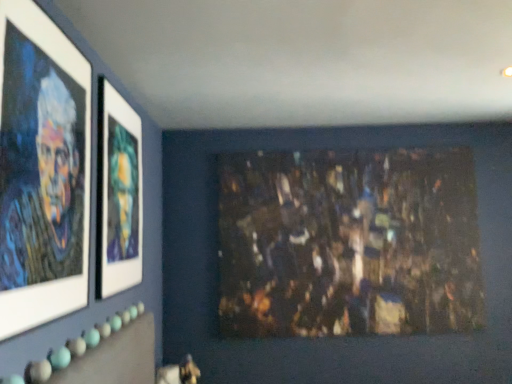
Question: From the image's perspective, is dark textured painting at center on top of matte glass picture frame at upper left, the second picture frame viewed from the front?

Choices:
 (A) no
 (B) yes

Answer: (A)

Question: From the image's perspective, is dark textured painting at center located beneath matte glass picture frame at upper left, the second picture frame viewed from the front?

Choices:
 (A) no
 (B) yes

Answer: (B)

Question: Could you tell me if dark textured painting at center is turned towards matte glass picture frame at upper left, the second picture frame viewed from the front?

Choices:
 (A) no
 (B) yes

Answer: (B)

Question: Considering the relative sizes of dark textured painting at center and matte glass picture frame at upper left, the first picture frame viewed from the back, in the image provided, is dark textured painting at center shorter than matte glass picture frame at upper left, the first picture frame viewed from the back,?

Choices:
 (A) yes
 (B) no

Answer: (B)

Question: Can you confirm if dark textured painting at center is smaller than matte glass picture frame at upper left, the second picture frame viewed from the front?

Choices:
 (A) no
 (B) yes

Answer: (A)

Question: Looking at their shapes, would you say matte black portrait at left, arranged as the 1th picture frame when viewed from the front, is wider or thinner than dark textured painting at center?

Choices:
 (A) wide
 (B) thin

Answer: (B)

Question: From the image's perspective, is matte black portrait at left, arranged as the 1th picture frame when viewed from the front, located above or below dark textured painting at center?

Choices:
 (A) below
 (B) above

Answer: (B)

Question: Would you say matte black portrait at left, arranged as the 1th picture frame when viewed from the front, is to the left or to the right of dark textured painting at center in the picture?

Choices:
 (A) left
 (B) right

Answer: (A)

Question: From a real-world perspective, is matte black portrait at left, arranged as the 1th picture frame when viewed from the front, positioned above or below dark textured painting at center?

Choices:
 (A) above
 (B) below

Answer: (A)

Question: Looking at their shapes, would you say matte glass picture frame at upper left, the first picture frame viewed from the back, is wider or thinner than dark textured painting at center?

Choices:
 (A) wide
 (B) thin

Answer: (B)

Question: Based on their sizes in the image, would you say matte glass picture frame at upper left, the first picture frame viewed from the back, is bigger or smaller than dark textured painting at center?

Choices:
 (A) small
 (B) big

Answer: (A)

Question: From a real-world perspective, is matte glass picture frame at upper left, the first picture frame viewed from the back, physically located above or below dark textured painting at center?

Choices:
 (A) above
 (B) below

Answer: (A)

Question: Is point (115, 292) closer or farther from the camera than point (223, 249)?

Choices:
 (A) farther
 (B) closer

Answer: (B)

Question: Is point (466, 235) closer or farther from the camera than point (52, 81)?

Choices:
 (A) closer
 (B) farther

Answer: (B)

Question: Looking at the image, does dark textured painting at center seem bigger or smaller compared to matte black portrait at left, which is counted as the 2th picture frame, starting from the back?

Choices:
 (A) small
 (B) big

Answer: (B)